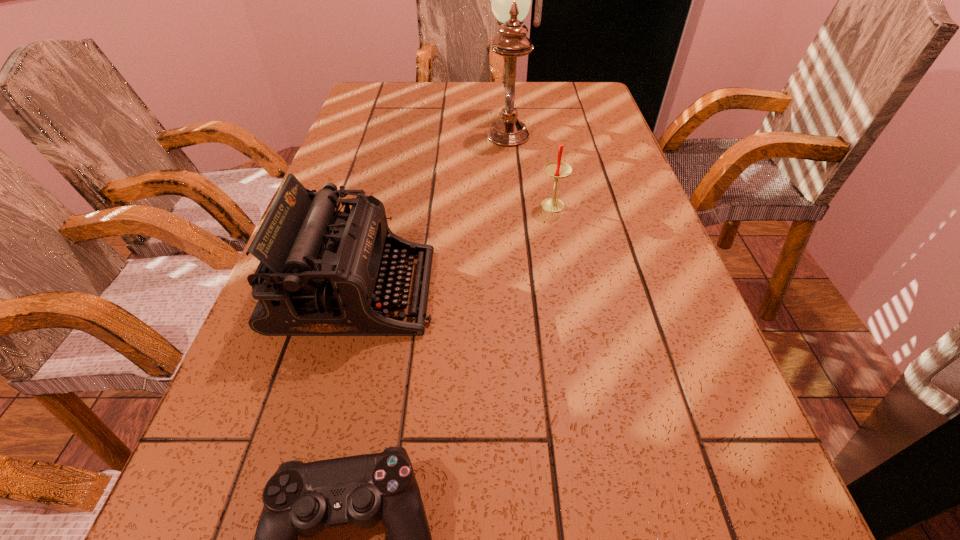
Identify the location of object positioned at the left edge. Image resolution: width=960 pixels, height=540 pixels. (322, 271).

The height and width of the screenshot is (540, 960). In order to click on vacant space at the far edge of the desktop in this screenshot , I will do `click(430, 111)`.

The height and width of the screenshot is (540, 960). In the image, there is a desktop. What are the coordinates of `vacant space at the left edge` in the screenshot? It's located at (279, 431).

Where is `free space at the right edge of the desktop`? free space at the right edge of the desktop is located at coordinates (589, 125).

Find the location of `free spot at the far right corner of the desktop`. free spot at the far right corner of the desktop is located at coordinates [583, 96].

This screenshot has height=540, width=960. Identify the location of vacant space in between the typewriter and the farthest object. (431, 208).

Where is `empty location between the candle and the third farthest object`? empty location between the candle and the third farthest object is located at coordinates (454, 249).

This screenshot has height=540, width=960. Identify the location of free space between the third farthest object and the tallest object. pos(431,208).

Image resolution: width=960 pixels, height=540 pixels. I want to click on free space between the oil lamp and the third shortest object, so click(x=431, y=208).

The width and height of the screenshot is (960, 540). I want to click on vacant space that is in between the typewriter and the candle, so click(x=454, y=249).